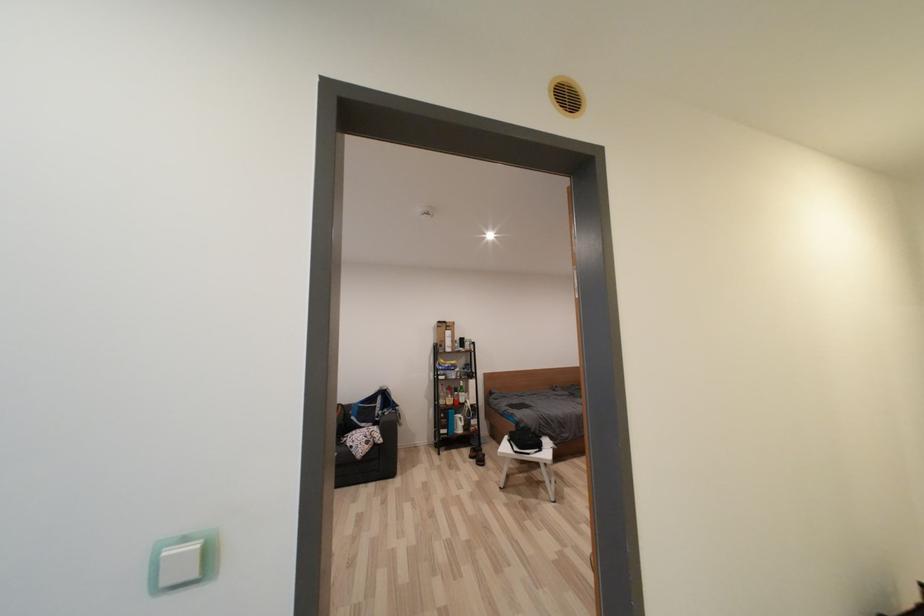
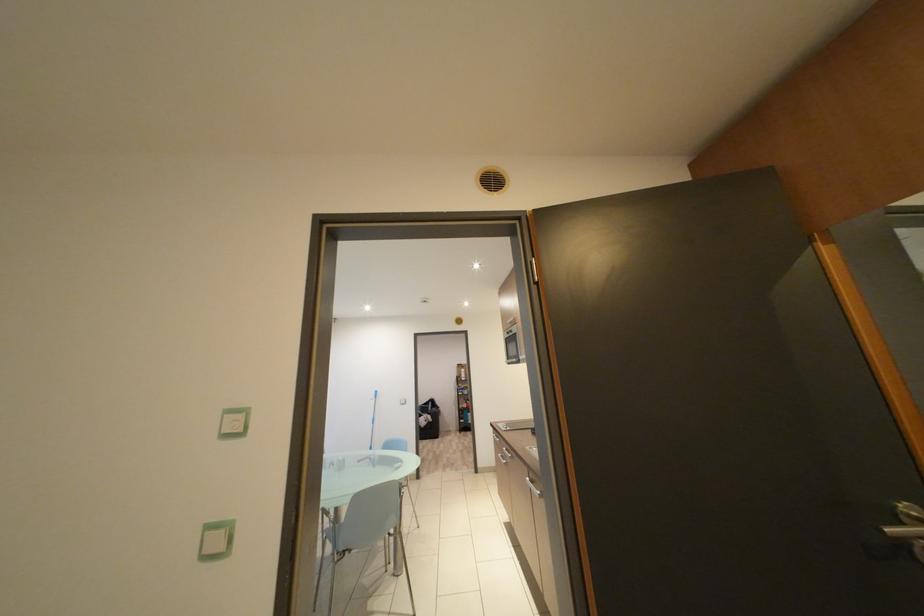
What movement of the cameraman would produce the second image?

The cameraman moved toward right, backward.